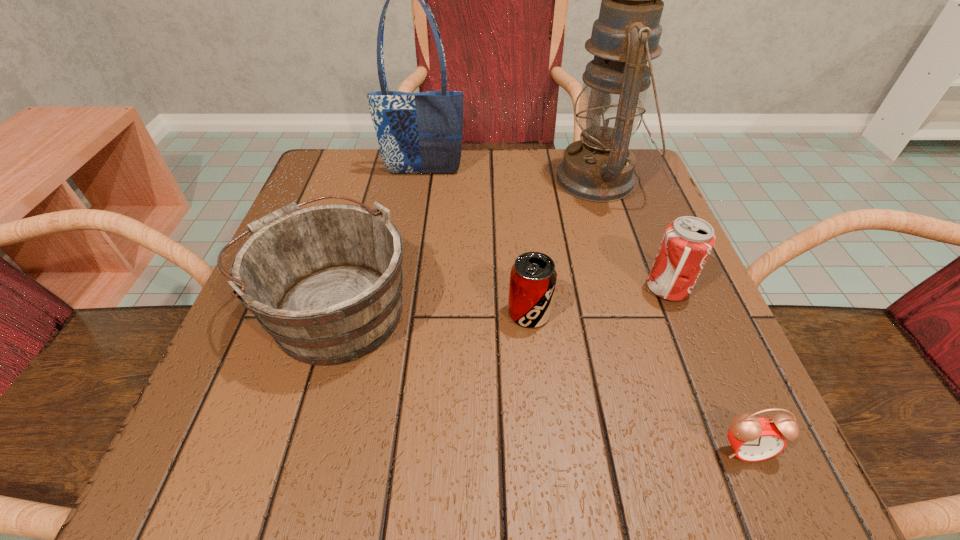
You are a GUI agent. You are given a task and a screenshot of the screen. Output one action in this format:
    pyautogui.click(x=<x>, y=<y>)
    Task: Click on the vacant space situated 0.060m on the right of the wine bucket
    Image resolution: width=960 pixels, height=540 pixels.
    Given the screenshot: What is the action you would take?
    pyautogui.click(x=450, y=307)

Find the location of a particular element. The image size is (960, 540). free space located 0.210m on the front of the taller soda can is located at coordinates (723, 426).

Where is `vacant point located 0.070m on the left of the fifth tallest object`? vacant point located 0.070m on the left of the fifth tallest object is located at coordinates (465, 313).

You are a GUI agent. You are given a task and a screenshot of the screen. Output one action in this format:
    pyautogui.click(x=<x>, y=<y>)
    Task: Click on the oil lamp that is positioned at the far edge
    
    Given the screenshot: What is the action you would take?
    pyautogui.click(x=600, y=168)

What are the coordinates of `shopping bag at the far edge` in the screenshot? It's located at (418, 133).

Image resolution: width=960 pixels, height=540 pixels. Identify the location of object that is at the near edge. (752, 439).

Identify the location of shopping bag at the left edge. (418, 133).

Find the location of a particular element. This screenshot has width=960, height=540. wine bucket at the left edge is located at coordinates click(325, 281).

Locate an element on the screen. oil lamp located at the right edge is located at coordinates (600, 168).

In order to click on soda can present at the right edge in this screenshot , I will do `click(688, 241)`.